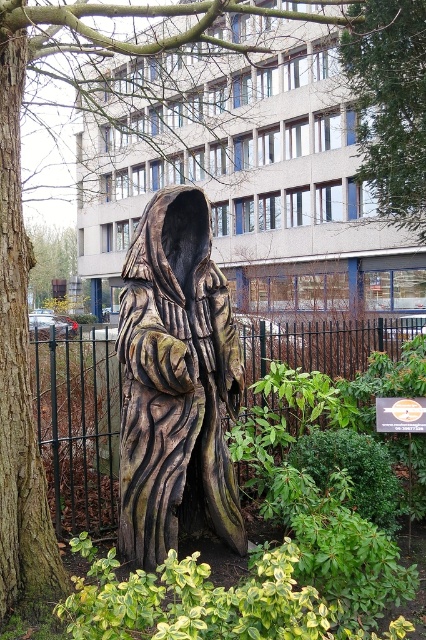
Question: Can you confirm if wooden statue at center is smaller than brown textured bark at left?

Choices:
 (A) yes
 (B) no

Answer: (B)

Question: Which of the following is the closest to the observer?

Choices:
 (A) black metal fence at center
 (B) green leafy tree at upper center
 (C) wooden statue at center
 (D) brown textured bark at left

Answer: (D)

Question: Where is wooden statue at center located in relation to brown textured bark at left in the image?

Choices:
 (A) right
 (B) left

Answer: (A)

Question: Can you confirm if wooden statue at center is positioned above brown textured bark at left?

Choices:
 (A) no
 (B) yes

Answer: (A)

Question: Among these objects, which one is nearest to the camera?

Choices:
 (A) wooden statue at center
 (B) brown textured bark at left
 (C) black metal fence at center
 (D) green leafy tree at upper center

Answer: (B)

Question: Which point is farther to the camera?

Choices:
 (A) (379, 186)
 (B) (25, 502)
 (C) (94, 422)

Answer: (A)